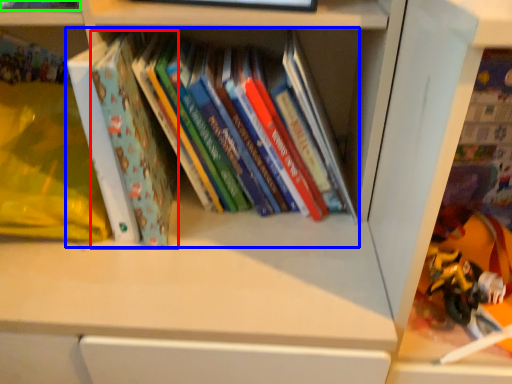
Question: Estimate the real-world distances between objects in this image. Which object is closer to paperback book (highlighted by a red box), book (highlighted by a blue box) or book (highlighted by a green box)?

Choices:
 (A) book
 (B) book

Answer: (A)